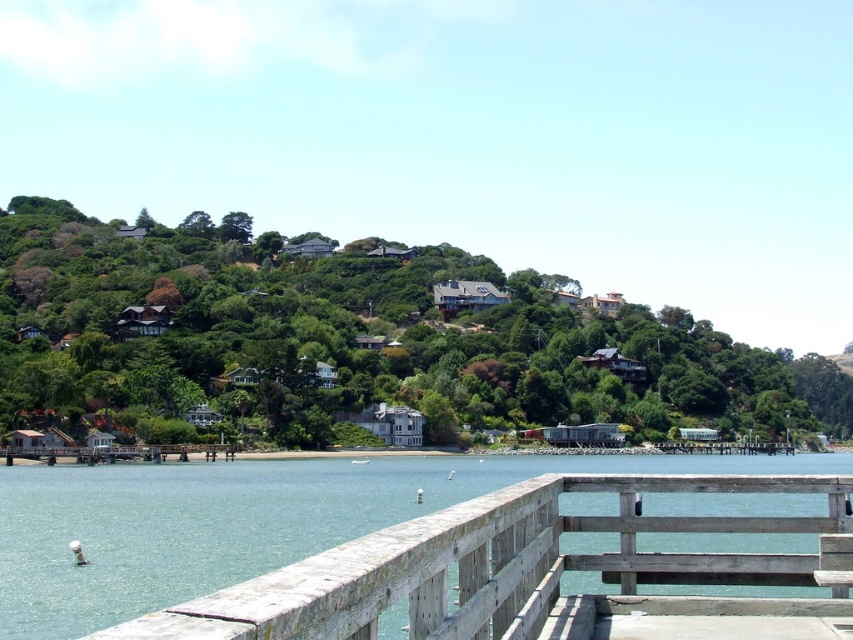
From the picture: Based on the scene description, which object occupies a wider area in the image? The green leafy hillside at upper center or the weathered wood rail at lower center?

The green leafy hillside at upper center occupies a wider area in the image because its width is larger than that of the weathered wood rail at lower center.

You are standing on the wooden pier and looking out at the scene. Which object is positioned higher in the image, the green leafy hillside at upper center or the weathered wood rail at lower center?

The green leafy hillside at upper center is located above the weathered wood rail at lower center, so it is positioned higher in the image.